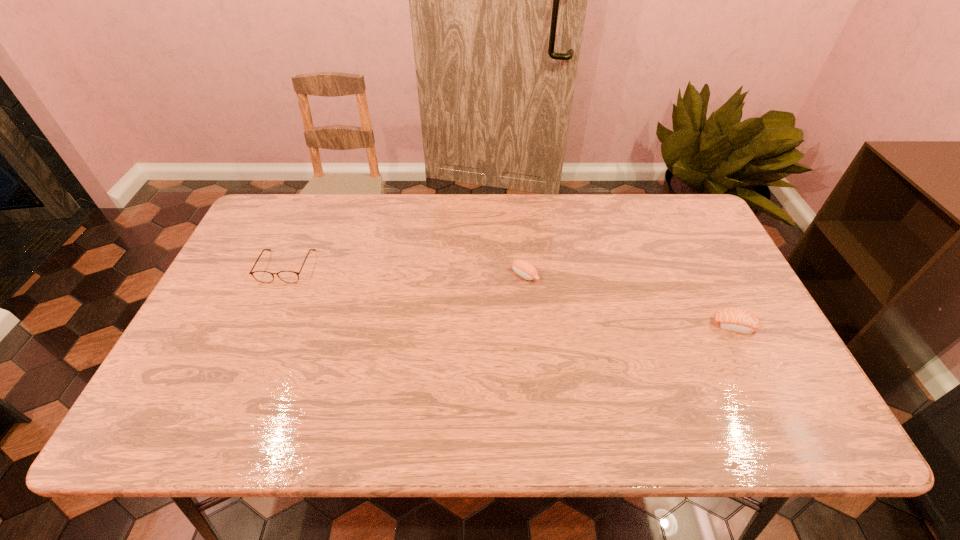
Where is `free space at the far edge of the desktop`? free space at the far edge of the desktop is located at coordinates (329, 200).

At what (x,y) coordinates should I click in order to perform the action: click on free space at the near edge. Please return your answer as a coordinate pair (x, y). Looking at the image, I should click on (640, 408).

Image resolution: width=960 pixels, height=540 pixels. I want to click on vacant region at the left edge, so click(x=228, y=273).

You are a GUI agent. You are given a task and a screenshot of the screen. Output one action in this format:
    pyautogui.click(x=<x>, y=<y>)
    Task: Click on the vacant space at the right edge of the desktop
    The height and width of the screenshot is (540, 960).
    Given the screenshot: What is the action you would take?
    pyautogui.click(x=672, y=249)

Locate an element on the screen. This screenshot has height=540, width=960. vacant space at the far left corner of the desktop is located at coordinates (276, 199).

The width and height of the screenshot is (960, 540). In the image, there is a desktop. What are the coordinates of `vacant area at the near left corner` in the screenshot? It's located at (216, 403).

Where is `free location at the far right corner`? The width and height of the screenshot is (960, 540). free location at the far right corner is located at coordinates (701, 214).

Where is `free point between the spectacles and the left sushi`? The height and width of the screenshot is (540, 960). free point between the spectacles and the left sushi is located at coordinates (406, 271).

The height and width of the screenshot is (540, 960). What are the coordinates of `blank region between the second object from right to left and the rightmost object` in the screenshot? It's located at (630, 301).

This screenshot has height=540, width=960. What are the coordinates of `free space between the right sushi and the farther sushi` in the screenshot? It's located at (630, 301).